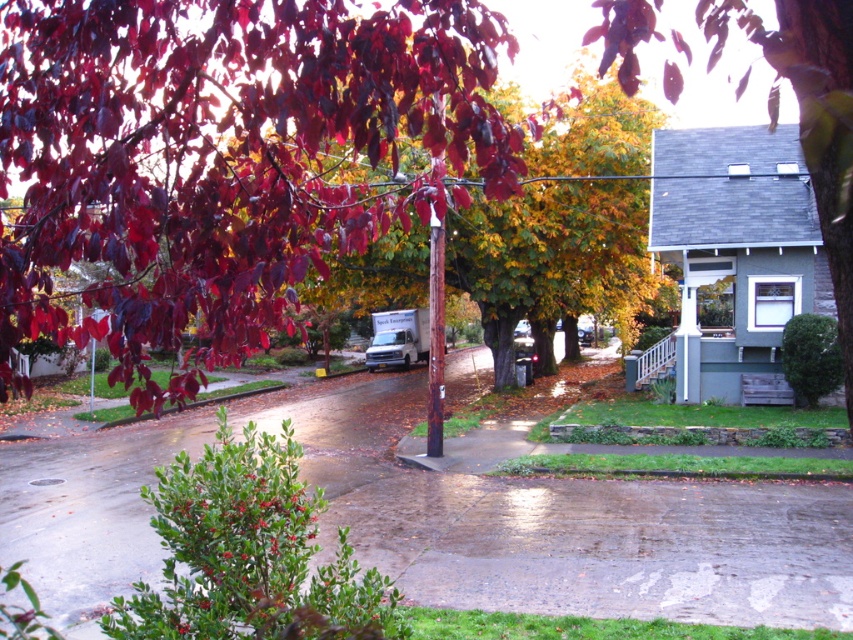
You are a bird looking for a place to perch. You see the shiny crimson leaves at upper left and the green leafy tree at upper right. Which one is closer to you?

The shiny crimson leaves at upper left are closer to you since they are positioned at the upper left of the scene, while the green leafy tree at upper right is further away. The distance between them is 6.55 meters, but the question is about proximity from your perspective as the bird. Since the leaves are at upper left and the tree is at upper right, their positions suggest the leaves are closer in the foreground compared to the tree in the middle ground.

You are a window cleaner standing at the base of the tree with the shiny crimson leaves at upper left. You need to clean the window of the house on the right side of the image. Can you reach the window from your current position without moving closer to the tree?

The shiny crimson leaves at upper left are 8.70 feet apart, so yes, you can reach the window of the house on the right side from your current position as the distance between the leaves allows for a clear line of sight and access.